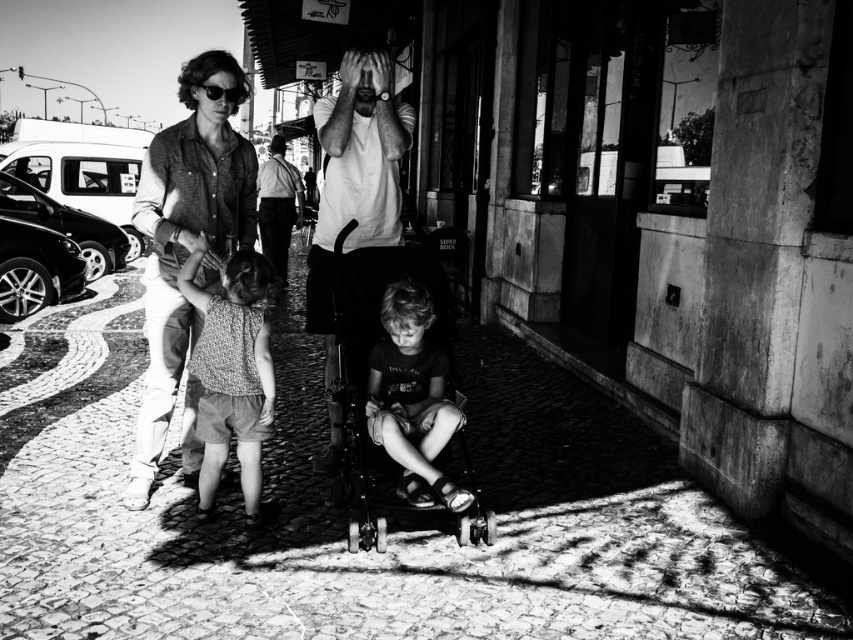
You are a fashion designer observing the street scene. You notice the knitted fabric dress at center and the shiny black sunglasses at upper left. Which item would you estimate has a larger width when viewed from the front?

The knitted fabric dress at center might be wider than shiny black sunglasses at upper left, so the knitted fabric dress at center likely has a larger width when viewed from the front.

You are a photographer trying to capture a candid shot of the metallic stroller at center and the smooth white shirt at center in the scene. Based on their positions, which object should you focus on first if you want to ensure both are in the frame?

The metallic stroller at center is located below the smooth white shirt at center, so you should focus on the smooth white shirt at center first to ensure both are in the frame.